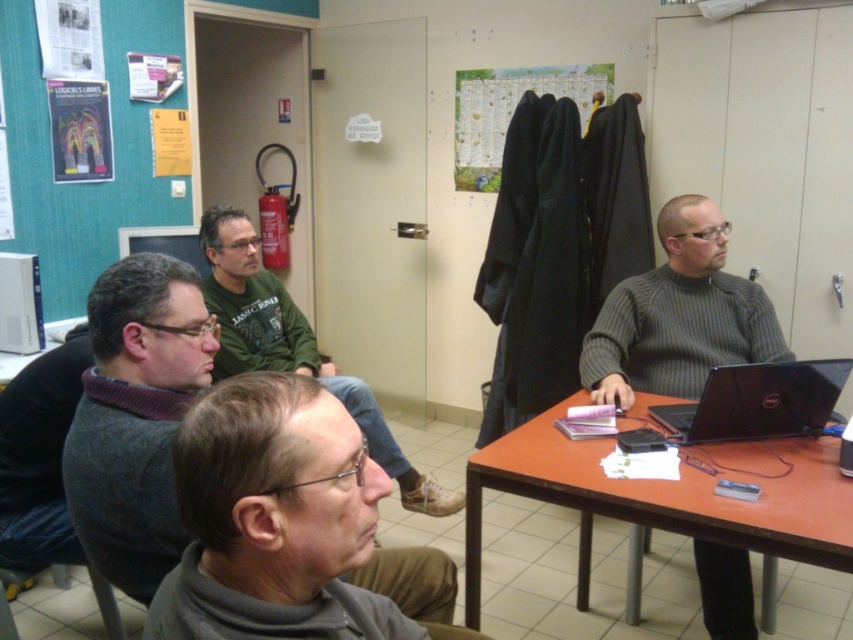
Question: Which point appears closest to the camera in this image?

Choices:
 (A) (682, 403)
 (B) (704, 381)
 (C) (537, 435)

Answer: (C)

Question: Which of these objects is positioned closest to the gray sweater at left?

Choices:
 (A) paper map at center
 (B) green jersey at center
 (C) black matte laptop at center right
 (D) brown wooden table at right

Answer: (D)

Question: Does gray ribbed sweater at center appear on the right side of black matte laptop at center right?

Choices:
 (A) yes
 (B) no

Answer: (A)

Question: Does gray sweater at left appear under gray ribbed sweater at center?

Choices:
 (A) no
 (B) yes

Answer: (B)

Question: Which of the following is the farthest from the observer?

Choices:
 (A) black matte laptop at center right
 (B) gray sweater at left
 (C) paper map at center
 (D) gray ribbed sweater at center

Answer: (C)

Question: Does gray ribbed sweater at center have a larger size compared to paper map at center?

Choices:
 (A) no
 (B) yes

Answer: (A)